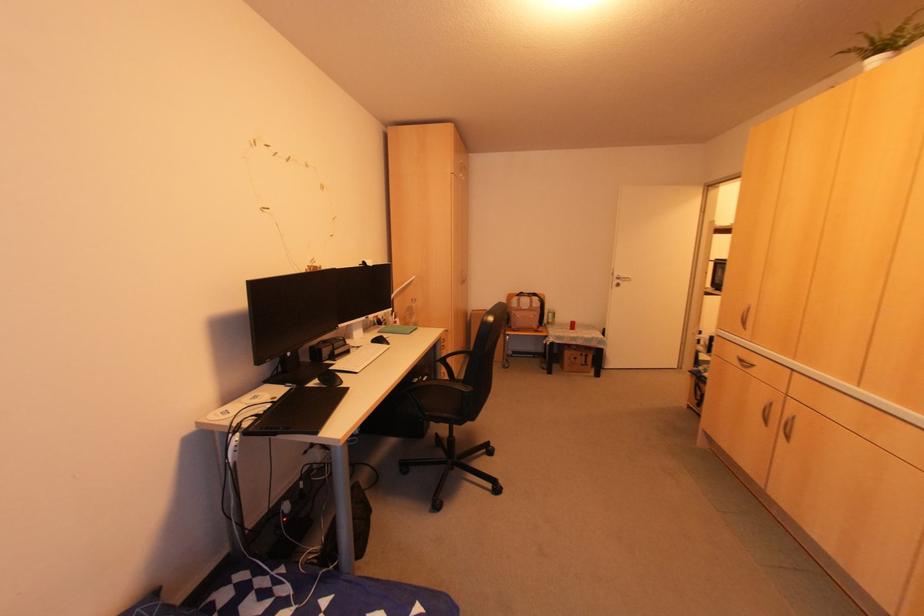
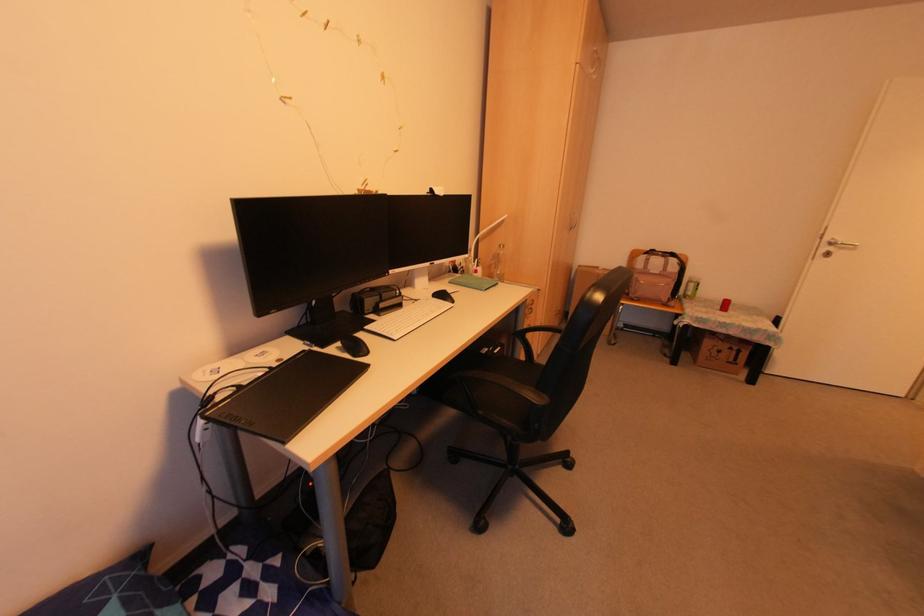
Find the pixel in the second image that matches point 570,326 in the first image.

(723, 306)